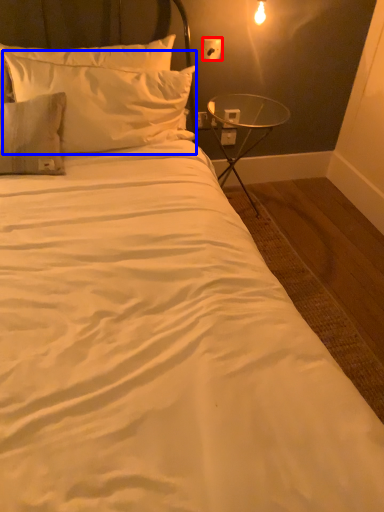
Question: Among these objects, which one is nearest to the camera, electric outlet (highlighted by a red box) or pillow (highlighted by a blue box)?

Choices:
 (A) electric outlet
 (B) pillow

Answer: (B)